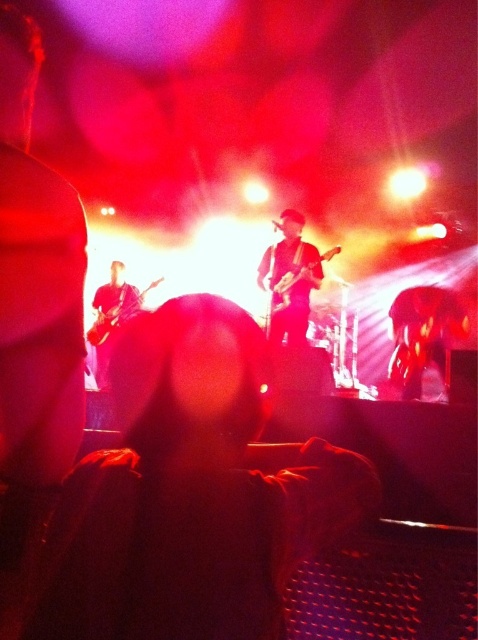
Question: Which point is closer to the camera?

Choices:
 (A) (87, 332)
 (B) (115, 266)
 (C) (275, 276)

Answer: (C)

Question: Is black leather jacket at center wider than glossy black guitar at left?

Choices:
 (A) no
 (B) yes

Answer: (A)

Question: Which object is closer to the camera taking this photo?

Choices:
 (A) black leather jacket at center
 (B) glossy black guitar at left
 (C) shiny black guitar at center
 (D) matte black guitar at left

Answer: (A)

Question: Does black leather jacket at center appear under glossy black guitar at left?

Choices:
 (A) no
 (B) yes

Answer: (B)

Question: Is black leather jacket at center wider than shiny black guitar at center?

Choices:
 (A) yes
 (B) no

Answer: (B)

Question: Which object is the farthest from the shiny black guitar at center?

Choices:
 (A) glossy black guitar at left
 (B) matte black guitar at left
 (C) black leather jacket at center

Answer: (C)